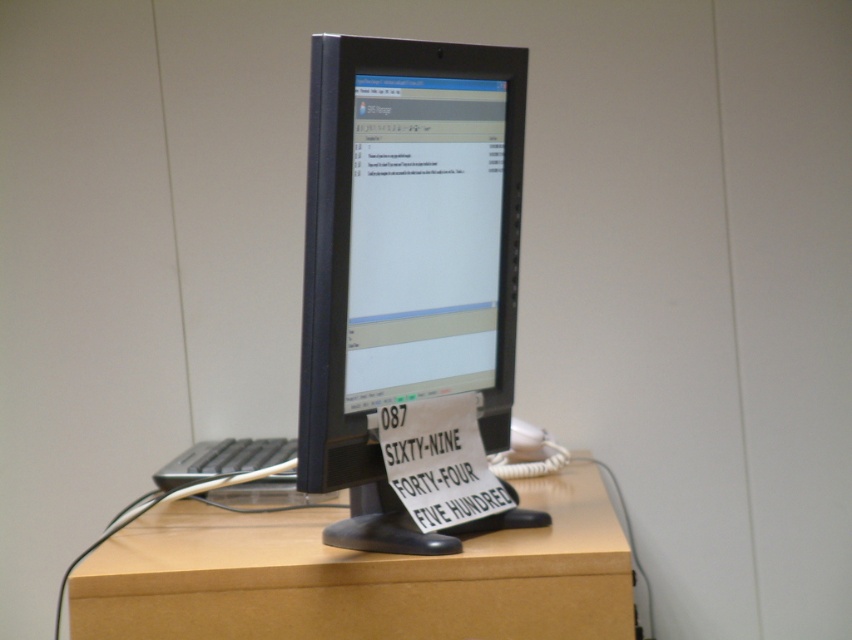
Is point (504, 257) less distant than point (167, 577)?

That is False.

Does matte black monitor at center lie in front of light brown wood at center?

That is True.

Where is `matte black monitor at center`? This screenshot has width=852, height=640. matte black monitor at center is located at coordinates (406, 241).